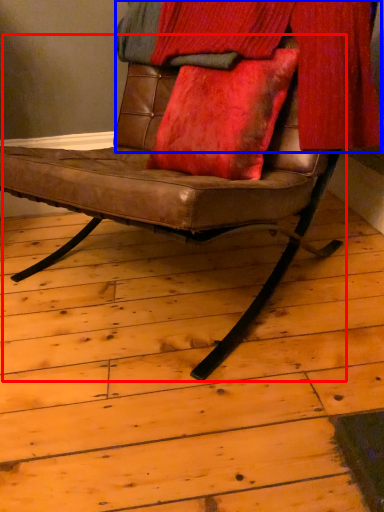
Question: Which object appears closest to the camera in this image, chair (highlighted by a red box) or curtain (highlighted by a blue box)?

Choices:
 (A) chair
 (B) curtain

Answer: (A)